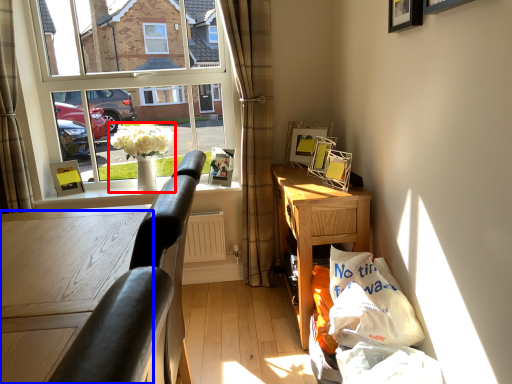
Question: Which object is further to the camera taking this photo, houseplant (highlighted by a red box) or table (highlighted by a blue box)?

Choices:
 (A) houseplant
 (B) table

Answer: (A)